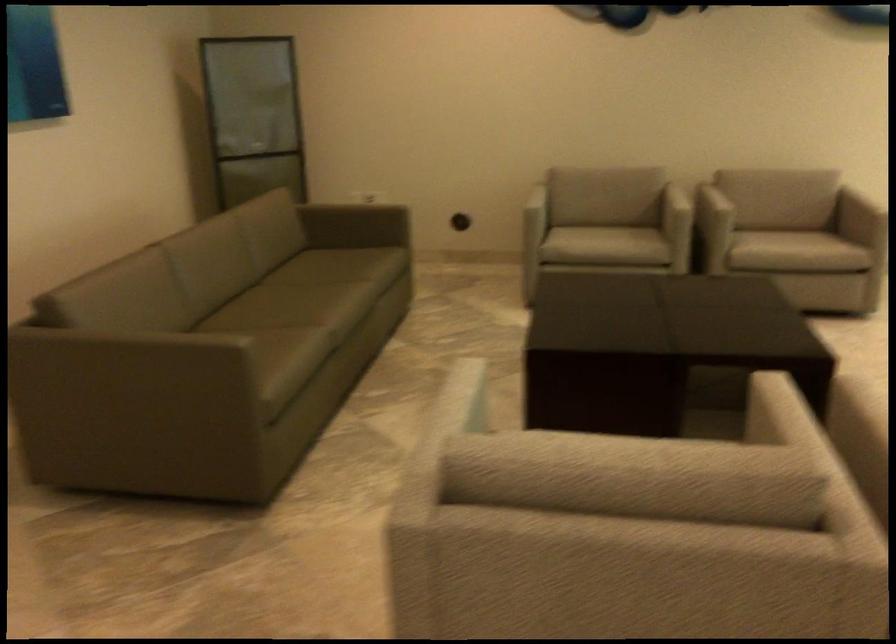
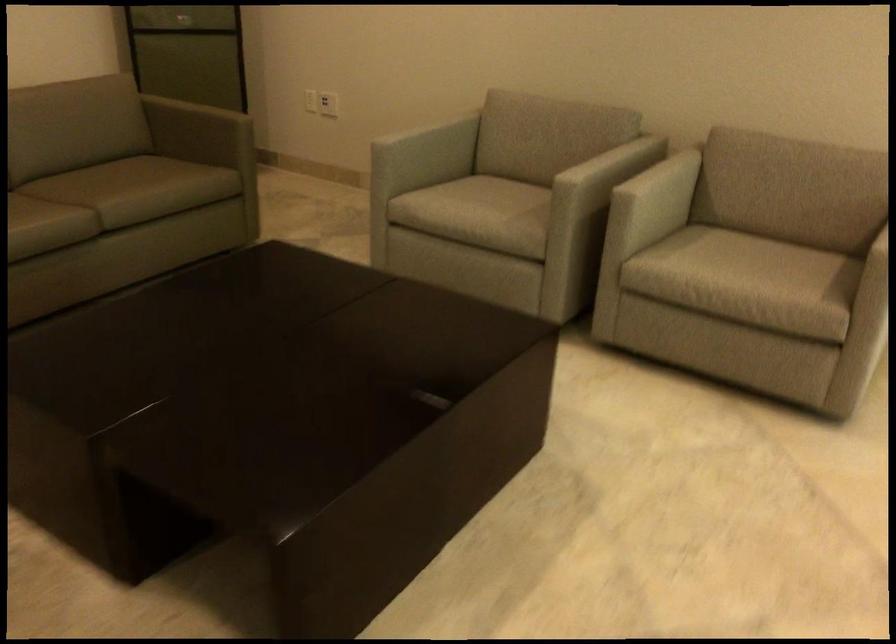
Which direction would the cameraman need to move to produce the second image?

The cameraman moved toward right, forward.